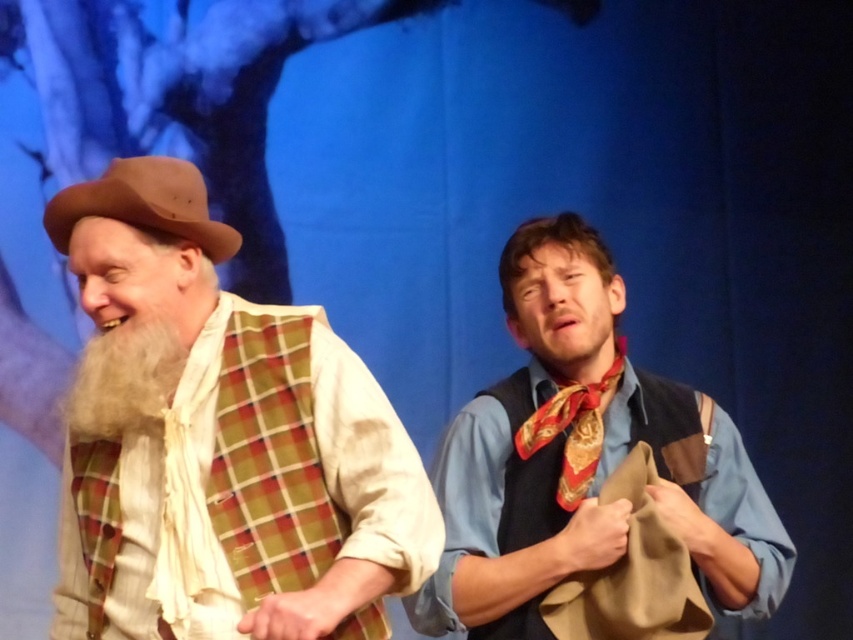
Based on the photo, you are a costume designer examining the stage setup. You need to determine if the matte brown hat at left will block the view of the white fluffy beard at left when viewed from the audience. Based on their heights, is this a concern?

The matte brown hat at left is taller than the white fluffy beard at left, so it might block the view of the beard from certain angles. Adjust the hat position or beard styling to ensure visibility.